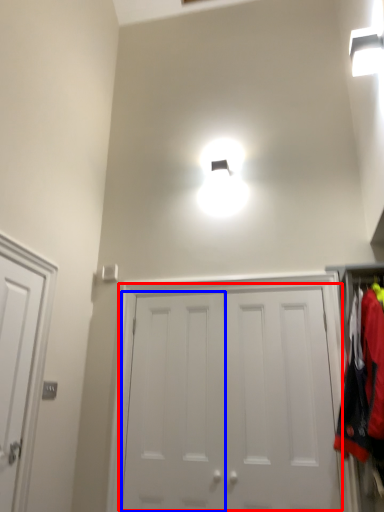
Question: Which object is closer to the camera taking this photo, door (highlighted by a red box) or door (highlighted by a blue box)?

Choices:
 (A) door
 (B) door

Answer: (A)